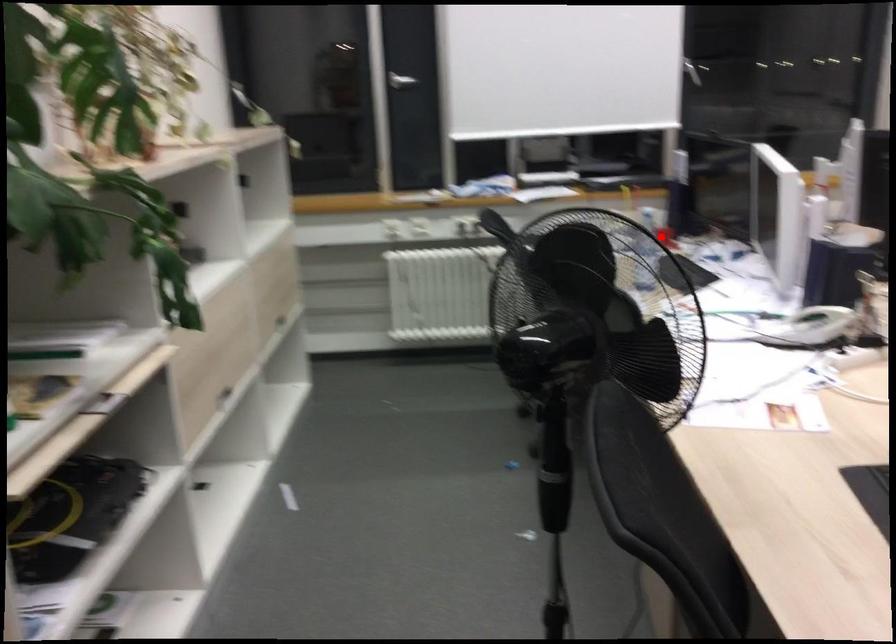
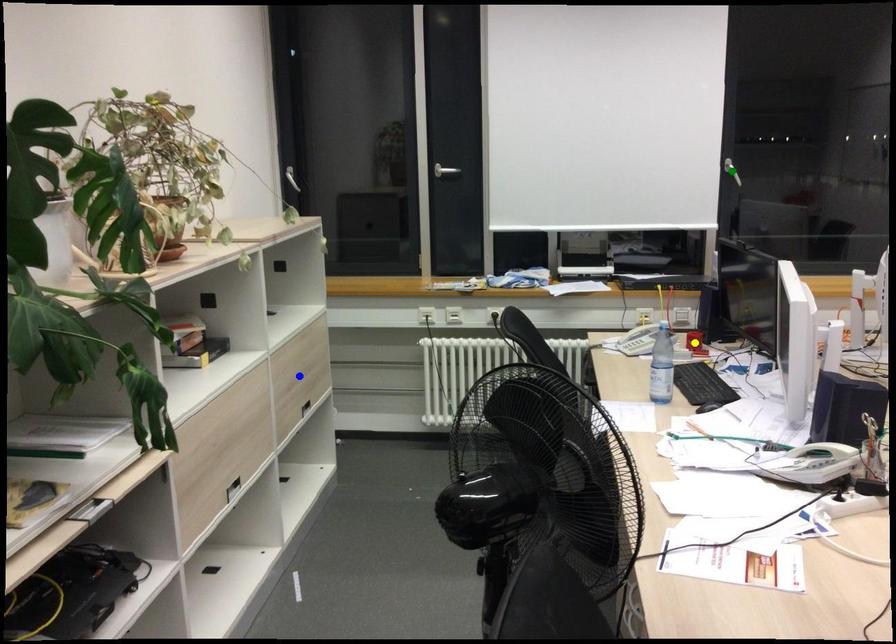
Question: I am providing you with two images of the same scene from different viewpoints. A red point is marked on the first image. You are given multiple points on the second image. Which mark in image 2 goes with the point in image 1?

Choices:
 (A) green point
 (B) yellow point
 (C) blue point

Answer: (B)